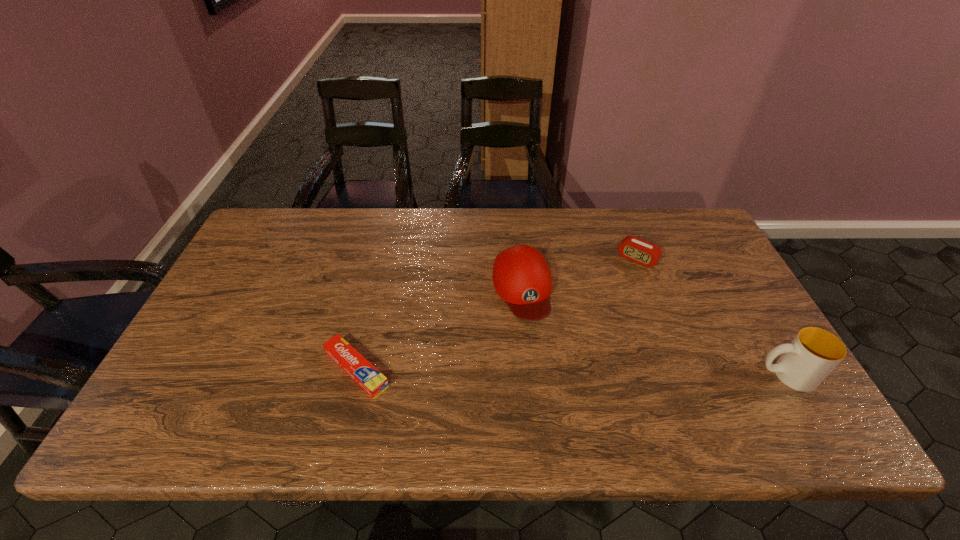
You are a GUI agent. You are given a task and a screenshot of the screen. Output one action in this format:
    pyautogui.click(x=<x>, y=<y>)
    Task: Click on the vacant space that satisfies the following two spatial constraints: 1. on the front side of the baseball cap; 2. with the handle on the side of the cup
    The image size is (960, 540).
    Given the screenshot: What is the action you would take?
    pyautogui.click(x=531, y=375)

Locate an element on the screen. The width and height of the screenshot is (960, 540). vacant area that satisfies the following two spatial constraints: 1. on the front side of the third object from right to left; 2. with the handle on the side of the cup is located at coordinates (531, 375).

Locate an element on the screen. This screenshot has height=540, width=960. vacant space that satisfies the following two spatial constraints: 1. on the front side of the rightmost object; 2. with the handle on the side of the toothpaste is located at coordinates (355, 375).

Identify the location of blank area in the image that satisfies the following two spatial constraints: 1. on the front side of the alarm clock; 2. with the handle on the side of the cup. (683, 375).